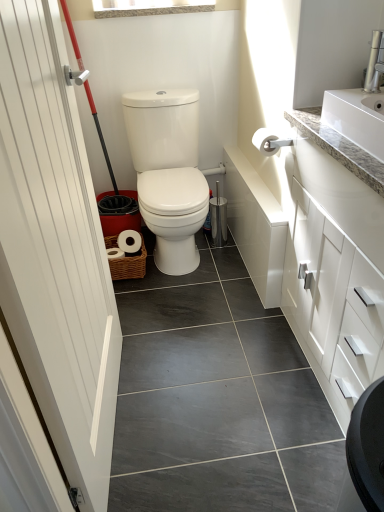
What do you see at coordinates (266, 141) in the screenshot?
I see `white matte toilet paper at center` at bounding box center [266, 141].

Identify the location of white matte toilet paper at center. (266, 141).

Where is `woven brown basket at lower center`? The height and width of the screenshot is (512, 384). woven brown basket at lower center is located at coordinates (129, 265).

Describe the element at coordinates (332, 304) in the screenshot. The height and width of the screenshot is (512, 384). I see `white glossy cabinet at upper right` at that location.

Where is `white glossy cabinet at upper right`? This screenshot has height=512, width=384. white glossy cabinet at upper right is located at coordinates (332, 304).

The image size is (384, 512). Find the location of `silver metallic faucet at upper right`. silver metallic faucet at upper right is located at coordinates (374, 63).

Looking at this image, is white wood door at left facing towards white glossy cabinet at upper right?

Yes, white wood door at left is aimed at white glossy cabinet at upper right.

From the picture: Is white wood door at left in contact with white glossy cabinet at upper right?

No, white wood door at left is not in contact with white glossy cabinet at upper right.

Which point is more distant from viewer, (x=50, y=248) or (x=334, y=254)?

The point (x=334, y=254) is more distant.

From a real-world perspective, who is located lower, white wood door at left or white glossy cabinet at upper right?

white glossy cabinet at upper right, from a real-world perspective.

Between white wood door at left and white matte toilet paper at center, which one is positioned behind?

white matte toilet paper at center is more distant.

Would you say white wood door at left is a long distance from white matte toilet paper at center?

That's not correct — white wood door at left is a little close to white matte toilet paper at center.

Can you tell me how much white wood door at left and white matte toilet paper at center differ in facing direction?

The angular difference between white wood door at left and white matte toilet paper at center is 88.2 degrees.

Consider the image. Which of these two, white wood door at left or white matte toilet paper at center, stands taller?

white wood door at left is taller.

Is white glossy toilet at center not inside white matte toilet paper at center?

white glossy toilet at center is positioned outside white matte toilet paper at center.

Where is `sit below the white matte toilet paper at center (from a real-world perspective)`? sit below the white matte toilet paper at center (from a real-world perspective) is located at coordinates (168, 172).

Is white glossy toilet at center not near white matte toilet paper at center?

No.

Can you confirm if white glossy toilet at center is wider than white matte toilet paper at center?

Yes, white glossy toilet at center is wider than white matte toilet paper at center.

Is white glossy toilet at center not inside white wood door at left?

white glossy toilet at center is positioned outside white wood door at left.

From the picture: Considering the sizes of objects white glossy toilet at center and white wood door at left in the image provided, who is shorter, white glossy toilet at center or white wood door at left?

white glossy toilet at center.

Based on the photo, from the image's perspective, is white glossy toilet at center over white wood door at left?

Yes, from the image's perspective, white glossy toilet at center is on top of white wood door at left.

Is silver metallic faucet at upper right turned away from woven brown basket at lower center?

No.

How different are the orientations of silver metallic faucet at upper right and woven brown basket at lower center in degrees?

90.8 degrees separate the facing orientations of silver metallic faucet at upper right and woven brown basket at lower center.

Does silver metallic faucet at upper right have a larger size compared to woven brown basket at lower center?

No, silver metallic faucet at upper right is not bigger than woven brown basket at lower center.

Between silver metallic faucet at upper right and white wood door at left, which one has smaller width?

Thinner between the two is silver metallic faucet at upper right.

Is silver metallic faucet at upper right positioned with its back to white wood door at left?

No.

Which is closer to the camera, (x=371, y=57) or (x=7, y=51)?

The point (x=7, y=51) is closer to the camera.

From the image's perspective, is silver metallic faucet at upper right located above or below white wood door at left?

Clearly, from the image's perspective, silver metallic faucet at upper right is above white wood door at left.

Does white glossy cabinet at upper right have a smaller size compared to white glossy toilet at center?

Incorrect, white glossy cabinet at upper right is not smaller in size than white glossy toilet at center.

Is there a large distance between white glossy cabinet at upper right and white glossy toilet at center?

white glossy cabinet at upper right is near white glossy toilet at center, not far away.

From the image's perspective, is white glossy cabinet at upper right located above white glossy toilet at center?

No, from the image's perspective, white glossy cabinet at upper right is not over white glossy toilet at center.

Image resolution: width=384 pixels, height=512 pixels. What are the coordinates of `cabinetry that appears in front of the white glossy toilet at center` in the screenshot? It's located at (332, 304).

In the image, there is a white glossy cabinet at upper right. Find the location of `door above it (from the image's perspective)`. door above it (from the image's perspective) is located at coordinates (55, 250).

I want to click on door in front of the white matte toilet paper at center, so click(x=55, y=250).

Considering their positions, is white glossy cabinet at upper right positioned further to white matte toilet paper at center than white glossy toilet at center?

white glossy cabinet at upper right is further to white matte toilet paper at center.

Consider the image. From the image, which object appears to be farther from silver metallic faucet at upper right, white wood door at left or woven brown basket at lower center?

Among the two, woven brown basket at lower center is located further to silver metallic faucet at upper right.

Based on their spatial positions, is white glossy toilet at center or white matte toilet paper at center further from silver metallic faucet at upper right?

white glossy toilet at center.

When comparing their distances from white glossy toilet at center, does white wood door at left or white matte toilet paper at center seem further?

white wood door at left is positioned further to the anchor white glossy toilet at center.

In the scene shown: From the image, which object appears to be nearer to white glossy toilet at center, woven brown basket at lower center or white wood door at left?

woven brown basket at lower center is positioned closer to the anchor white glossy toilet at center.

Consider the image. From the image, which object appears to be nearer to white glossy toilet at center, woven brown basket at lower center or silver metallic faucet at upper right?

The object closer to white glossy toilet at center is woven brown basket at lower center.

Looking at the image, which one is located closer to white matte toilet paper at center, white wood door at left or woven brown basket at lower center?

The object closer to white matte toilet paper at center is woven brown basket at lower center.

Which object lies further to the anchor point white matte toilet paper at center, silver metallic faucet at upper right or white wood door at left?

The object further to white matte toilet paper at center is white wood door at left.

At what (x,y) coordinates should I click in order to perform the action: click on cabinetry between white wood door at left and white matte toilet paper at center from front to back. Please return your answer as a coordinate pair (x, y). Looking at the image, I should click on pyautogui.click(x=332, y=304).

This screenshot has height=512, width=384. Find the location of `sit located between white wood door at left and woven brown basket at lower center in the depth direction`. sit located between white wood door at left and woven brown basket at lower center in the depth direction is located at coordinates (168, 172).

At what (x,y) coordinates should I click in order to perform the action: click on sit located between silver metallic faucet at upper right and woven brown basket at lower center in the depth direction. Please return your answer as a coordinate pair (x, y). Looking at the image, I should click on tap(168, 172).

Find the location of a particular element. The width and height of the screenshot is (384, 512). sit between white glossy cabinet at upper right and woven brown basket at lower center from front to back is located at coordinates (168, 172).